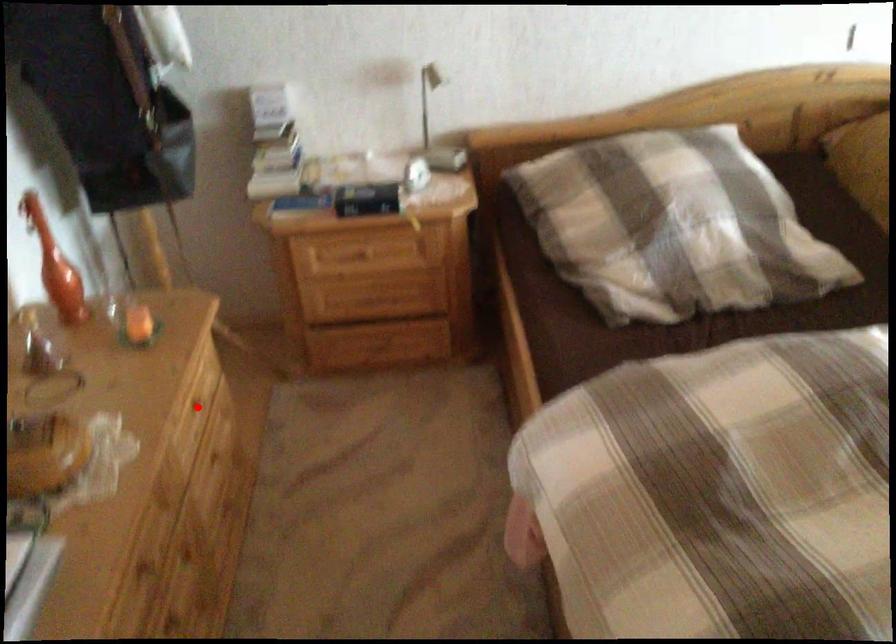
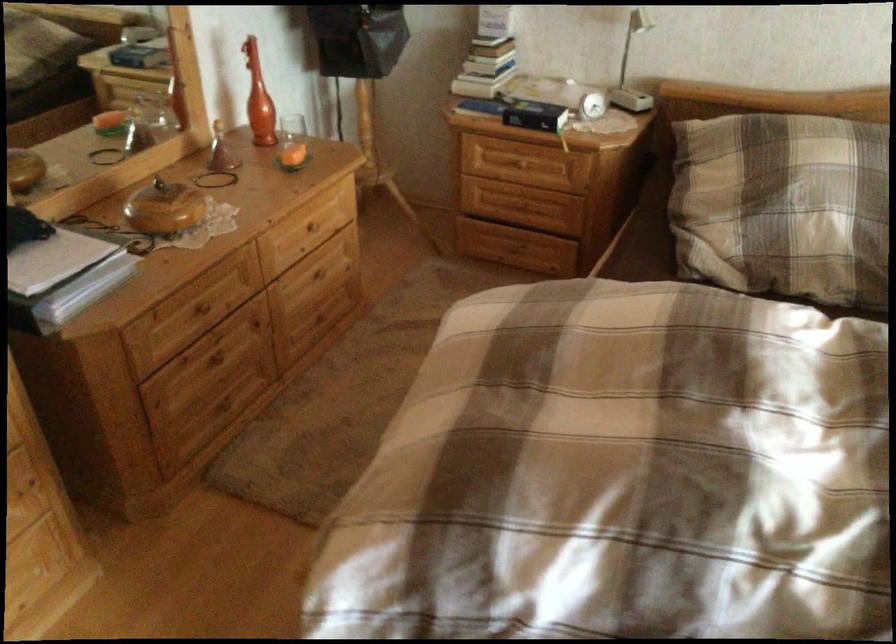
Question: I am providing you with two images of the same scene from different viewpoints. A red point is shown in image1. For the corresponding object point in image2, is it positioned nearer or farther from the camera?

Choices:
 (A) Nearer
 (B) Farther

Answer: (B)